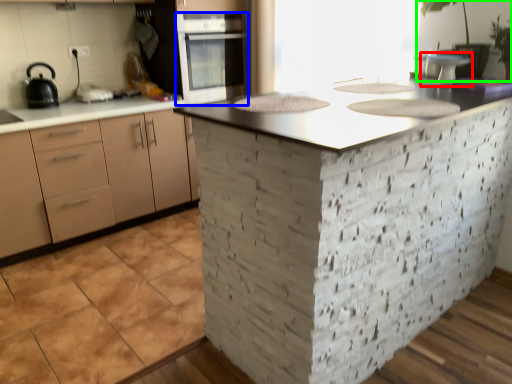
Question: Which is farther away from appliance (highlighted by a red box)? oven (highlighted by a blue box) or plant (highlighted by a green box)?

Choices:
 (A) oven
 (B) plant

Answer: (A)